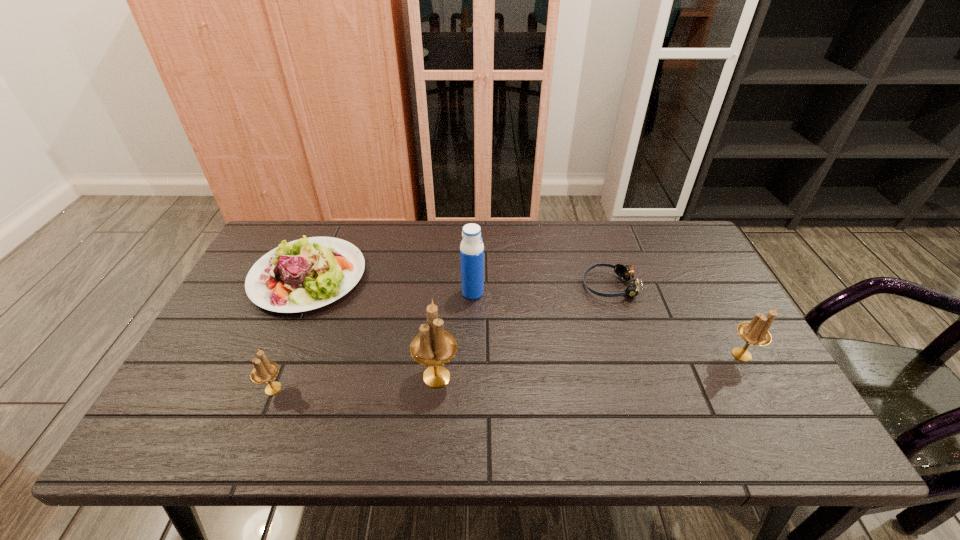
Find the location of `the shortest candle holder`. the shortest candle holder is located at coordinates 264,371.

At what (x,y) coordinates should I click in order to perform the action: click on the leftmost candle holder. Please return your answer as a coordinate pair (x, y). The width and height of the screenshot is (960, 540). Looking at the image, I should click on (264, 371).

This screenshot has width=960, height=540. Find the location of `the tallest candle holder`. the tallest candle holder is located at coordinates (433, 346).

The width and height of the screenshot is (960, 540). What are the coordinates of `the rightmost object` in the screenshot? It's located at (755, 332).

The width and height of the screenshot is (960, 540). Identify the location of the fourth shortest object. (755, 332).

Locate an element on the screen. This screenshot has width=960, height=540. the second shortest object is located at coordinates (305, 274).

You are a GUI agent. You are given a task and a screenshot of the screen. Output one action in this format:
    pyautogui.click(x=<x>, y=<y>)
    Task: Click on the water bottle
    The image size is (960, 540).
    Given the screenshot: What is the action you would take?
    pyautogui.click(x=471, y=248)

Find the location of a particular element. Image resolution: width=960 pixels, height=540 pixels. the second object from right to left is located at coordinates (626, 272).

In order to click on the shortest object in this screenshot , I will do [x=626, y=272].

At what (x,y) coordinates should I click in order to perform the action: click on vacant space located 0.350m on the right of the third shortest object. Please return your answer as a coordinate pair (x, y). This screenshot has width=960, height=540. Looking at the image, I should click on (437, 389).